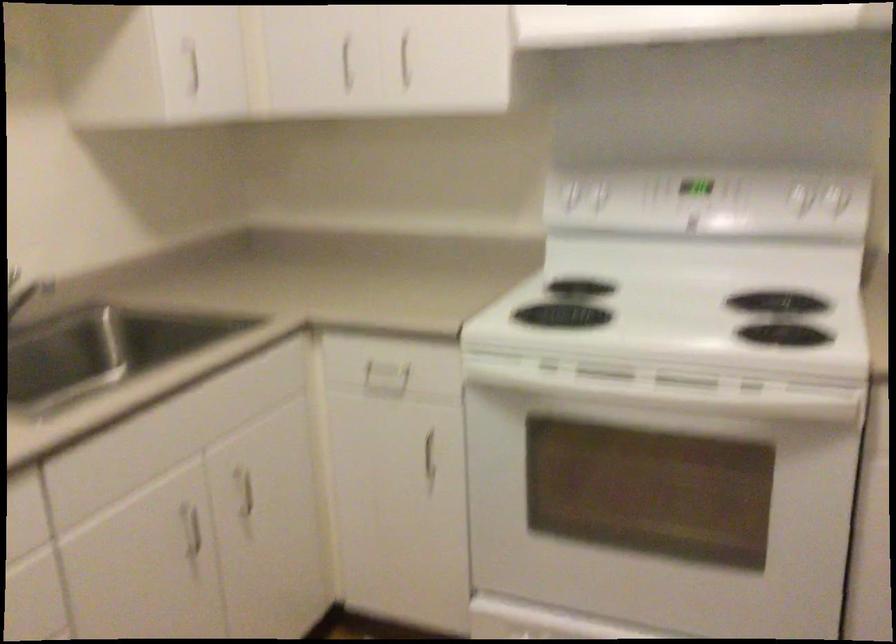
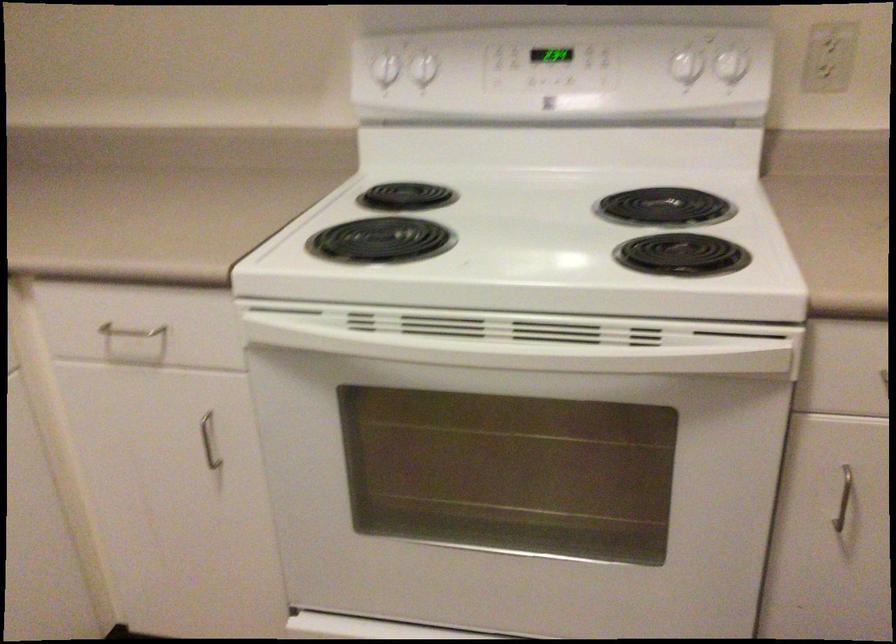
The point at (427, 455) is marked in the first image. Where is the corresponding point in the second image?

(209, 440)